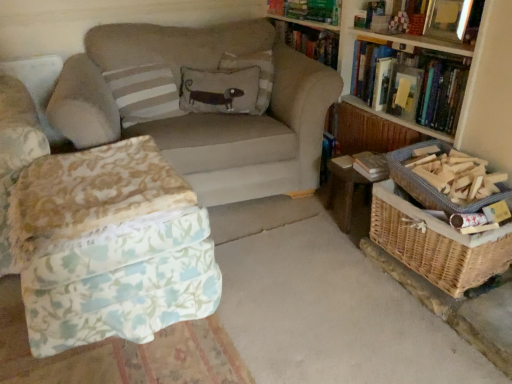
Where is `hardcover book at upper right, which appears as the second book when viewed from the top`? Image resolution: width=512 pixels, height=384 pixels. hardcover book at upper right, which appears as the second book when viewed from the top is located at coordinates pos(446,20).

Locate an element on the screen. This screenshot has height=384, width=512. white striped pillow at upper left, the 1th pillow viewed from the left is located at coordinates (144, 93).

Image resolution: width=512 pixels, height=384 pixels. What do you see at coordinates (144, 93) in the screenshot?
I see `white striped pillow at upper left, the third pillow from the right` at bounding box center [144, 93].

This screenshot has height=384, width=512. Describe the element at coordinates (325, 305) in the screenshot. I see `woven wicker basket at lower right` at that location.

In order to face woven wicker basket at lower right, should I rotate leftwards or rightwards?

Turn right approximately 26.646 degrees to face it.

Locate an element on the screen. The image size is (512, 384). hardcover book at right is located at coordinates (371, 166).

The height and width of the screenshot is (384, 512). I want to click on wooden bookcase at upper right, so click(415, 52).

Locate an element on the screen. hardcover book at upper right, acting as the 2th book starting from the bottom is located at coordinates (446, 20).

Between woven wicker basket at lower right and brown fabric pillow with dog design at center, the 2th pillow viewed from the right, which one appears on the left side from the viewer's perspective?

Positioned to the left is brown fabric pillow with dog design at center, the 2th pillow viewed from the right.

Choose the correct answer: Is woven wicker basket at lower right inside brown fabric pillow with dog design at center, acting as the second pillow starting from the left, or outside it?

woven wicker basket at lower right is located beyond the bounds of brown fabric pillow with dog design at center, acting as the second pillow starting from the left.

Considering the relative sizes of woven wicker basket at lower right and brown fabric pillow with dog design at center, acting as the second pillow starting from the left, in the image provided, is woven wicker basket at lower right thinner than brown fabric pillow with dog design at center, acting as the second pillow starting from the left,?

Incorrect, the width of woven wicker basket at lower right is not less than that of brown fabric pillow with dog design at center, acting as the second pillow starting from the left.

Consider the image. Who is shorter, beige fabric pillow with dog design at center, arranged as the third pillow when viewed from the left, or woven wood table at lower right?

Standing shorter between the two is woven wood table at lower right.

From a real-world perspective, who is located lower, beige fabric pillow with dog design at center, arranged as the first pillow when viewed from the right, or woven wood table at lower right?

From a 3D spatial view, woven wood table at lower right is below.

Is beige fabric pillow with dog design at center, arranged as the third pillow when viewed from the left, placed right next to woven wood table at lower right?

There is a gap between beige fabric pillow with dog design at center, arranged as the third pillow when viewed from the left, and woven wood table at lower right.

Does beige fabric pillow with dog design at center, arranged as the first pillow when viewed from the right, come in front of woven wood table at lower right?

No, beige fabric pillow with dog design at center, arranged as the first pillow when viewed from the right, is further to the viewer.

Is floral fabric ottoman at lower left bigger than woven brown basket at right, the 1th basket when ordered from top to bottom?

Yes, floral fabric ottoman at lower left is bigger than woven brown basket at right, the 1th basket when ordered from top to bottom.

Based on the photo, from the image's perspective, is floral fabric ottoman at lower left located above woven brown basket at right, the 1th basket when ordered from top to bottom?

No, from the image's perspective, floral fabric ottoman at lower left is not on top of woven brown basket at right, the 1th basket when ordered from top to bottom.

Are floral fabric ottoman at lower left and woven brown basket at right, the 1th basket when ordered from top to bottom, far apart?

Absolutely, floral fabric ottoman at lower left is distant from woven brown basket at right, the 1th basket when ordered from top to bottom.

Is woven wicker basket at lower right turned away from beige fabric couch at center?

No, beige fabric couch at center is not at the back of woven wicker basket at lower right.

Is woven wicker basket at lower right in front of or behind beige fabric couch at center in the image?

Clearly, woven wicker basket at lower right is in front of beige fabric couch at center.

Considering the sizes of objects woven wicker basket at lower right and beige fabric couch at center in the image provided, who is taller, woven wicker basket at lower right or beige fabric couch at center?

beige fabric couch at center.

Who is smaller, woven wicker basket at lower right or beige fabric couch at center?

woven wicker basket at lower right is smaller.

Which of these two, wooden bookcase at upper right or hardcover book at upper right, the 1th book in the bottom-to-top sequence, is bigger?

wooden bookcase at upper right is bigger.

Is the depth of wooden bookcase at upper right greater than that of hardcover book at upper right, positioned as the third book in top-to-bottom order?

No.

From a real-world perspective, is wooden bookcase at upper right physically located above or below hardcover book at upper right, the 1th book in the bottom-to-top sequence?

Clearly, from a real-world perspective, wooden bookcase at upper right is below hardcover book at upper right, the 1th book in the bottom-to-top sequence.

Is point (396, 23) positioned before point (374, 181)?

No.

How different are the orientations of hardcover book at upper right, which appears as the second book when viewed from the top, and hardcover book at right in degrees?

The angle between the facing direction of hardcover book at upper right, which appears as the second book when viewed from the top, and the facing direction of hardcover book at right is 6.17 degrees.

Is hardcover book at upper right, acting as the 2th book starting from the bottom, taller or shorter than hardcover book at right?

Clearly, hardcover book at upper right, acting as the 2th book starting from the bottom, is taller compared to hardcover book at right.

Is hardcover book at upper right, acting as the 2th book starting from the bottom, to the left or to the right of hardcover book at right in the image?

hardcover book at upper right, acting as the 2th book starting from the bottom, is to the right of hardcover book at right.

Considering the sizes of objects hardcover book at upper center, which is counted as the first book, starting from the top, and beige fabric pillow with dog design at center, arranged as the third pillow when viewed from the left, in the image provided, who is thinner, hardcover book at upper center, which is counted as the first book, starting from the top, or beige fabric pillow with dog design at center, arranged as the third pillow when viewed from the left,?

With smaller width is hardcover book at upper center, which is counted as the first book, starting from the top.

Does hardcover book at upper center, which ranks as the 3th book in bottom-to-top order, lie behind beige fabric pillow with dog design at center, arranged as the first pillow when viewed from the right?

Yes.

Measure the distance between hardcover book at upper center, which ranks as the 3th book in bottom-to-top order, and beige fabric pillow with dog design at center, arranged as the third pillow when viewed from the left.

18.13 inches.

This screenshot has width=512, height=384. Find the location of `pillow that is the 1st object to the left of the hardcover book at upper center, which ranks as the 3th book in bottom-to-top order, starting at the anchor`. pillow that is the 1st object to the left of the hardcover book at upper center, which ranks as the 3th book in bottom-to-top order, starting at the anchor is located at coordinates (260, 73).

Identify the location of concrete that is in front of the brown fabric pillow with dog design at center, acting as the second pillow starting from the left. (325, 305).

Locate an element on the screen. table below the beige fabric pillow with dog design at center, arranged as the third pillow when viewed from the left (from a real-world perspective) is located at coordinates (349, 185).

From the image, which object appears to be farther from hardcover book at upper right, the 1th book in the bottom-to-top sequence, floral fabric ottoman at lower left or hardcover book at upper center, which is counted as the first book, starting from the top?

Among the two, floral fabric ottoman at lower left is located further to hardcover book at upper right, the 1th book in the bottom-to-top sequence.

When comparing their distances from woven wicker basket at lower right, does floral fabric ottoman at lower left or woven brown basket at right, the 1th basket when ordered from top to bottom, seem closer?

Result: floral fabric ottoman at lower left is positioned closer to the anchor woven wicker basket at lower right.

Based on their spatial positions, is floral fabric ottoman at lower left or hardcover book at right further from beige fabric couch at center?

The object further to beige fabric couch at center is hardcover book at right.

Considering their positions, is beige fabric pillow with dog design at center, arranged as the third pillow when viewed from the left, positioned closer to hardcover book at upper right, positioned as the third book in top-to-bottom order, than floral fabric ottoman at lower left?

beige fabric pillow with dog design at center, arranged as the third pillow when viewed from the left, is closer to hardcover book at upper right, positioned as the third book in top-to-bottom order.

Which object lies nearer to the anchor point beige fabric couch at center, white striped pillow at upper left, the 1th pillow viewed from the left, or hardcover book at right?

white striped pillow at upper left, the 1th pillow viewed from the left, is positioned closer to the anchor beige fabric couch at center.

When comparing their distances from hardcover book at right, does floral fabric ottoman at lower left or hardcover book at upper right, the 1th book in the bottom-to-top sequence, seem further?

floral fabric ottoman at lower left is positioned further to the anchor hardcover book at right.

Which object lies nearer to the anchor point woven wood table at lower right, hardcover book at upper right, the 1th book in the bottom-to-top sequence, or beige fabric couch at center?

hardcover book at upper right, the 1th book in the bottom-to-top sequence.

From the image, which object appears to be farther from hardcover book at upper right, acting as the 2th book starting from the bottom, floral fabric ottoman at lower left or woven brown basket at right, the 1th basket when ordered from top to bottom?

floral fabric ottoman at lower left.

Where is `basket that lies between hardcover book at upper center, which ranks as the 3th book in bottom-to-top order, and woven wicker basket at right, which is the 2th basket in top-to-bottom order, from top to bottom`? The height and width of the screenshot is (384, 512). basket that lies between hardcover book at upper center, which ranks as the 3th book in bottom-to-top order, and woven wicker basket at right, which is the 2th basket in top-to-bottom order, from top to bottom is located at coordinates (430, 185).

I want to click on table between white striped pillow at upper left, the third pillow from the right, and woven wicker basket at right, which is the first basket in bottom-to-top order, in the horizontal direction, so click(x=349, y=185).

Identify the location of bookcase that lies between hardcover book at upper center, which ranks as the 3th book in bottom-to-top order, and hardcover book at right from top to bottom. (415, 52).

At what (x,y) coordinates should I click in order to perform the action: click on book between wooden bookcase at upper right and woven wicker basket at lower right in the vertical direction. Please return your answer as a coordinate pair (x, y). Image resolution: width=512 pixels, height=384 pixels. Looking at the image, I should click on pyautogui.click(x=411, y=83).